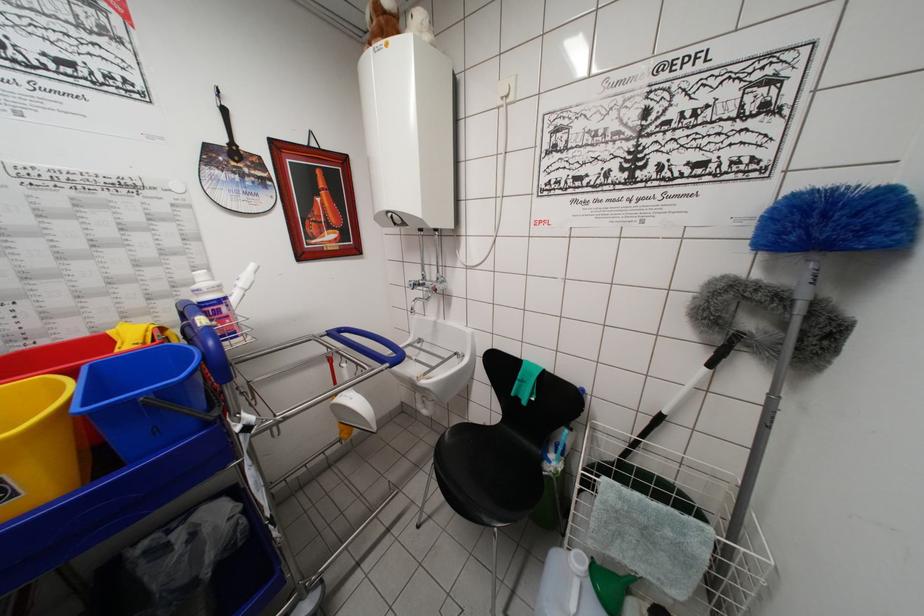
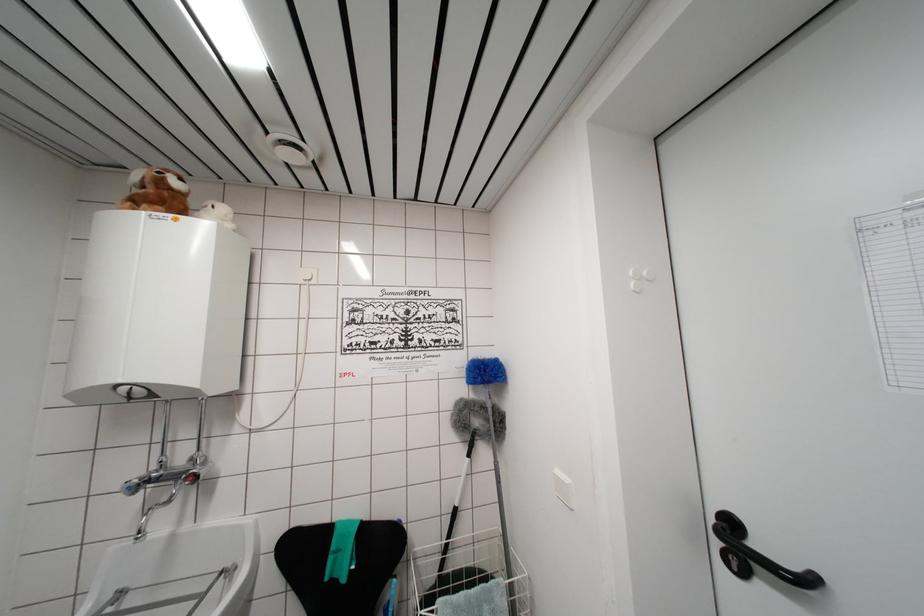
Find the pixel in the second image that matches (450,362) in the first image.

(209, 593)